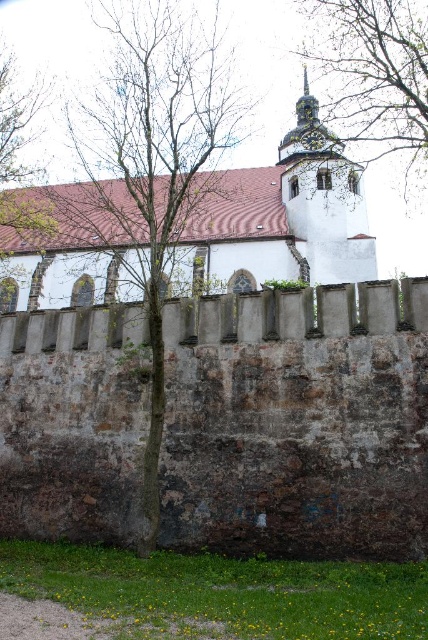
Between green leafy tree at upper right and green leafy tree at left, which one is positioned lower?

green leafy tree at left is below.

Is green leafy tree at upper right to the left of green leafy tree at left from the viewer's perspective?

In fact, green leafy tree at upper right is to the right of green leafy tree at left.

The width and height of the screenshot is (428, 640). Identify the location of green leafy tree at upper right. (374, 76).

Find the location of a particular element. The image size is (428, 640). green leafy tree at upper right is located at coordinates (374, 76).

Does brown bark tree at center appear on the right side of white stone church at upper center?

In fact, brown bark tree at center is to the left of white stone church at upper center.

Measure the distance between brown bark tree at center and white stone church at upper center.

brown bark tree at center is 40.66 feet away from white stone church at upper center.

Between point (139, 125) and point (226, 289), which one is positioned behind?

The point (139, 125) is behind.

The height and width of the screenshot is (640, 428). Find the location of `brown bark tree at center`. brown bark tree at center is located at coordinates (152, 163).

Who is positioned more to the left, brown bark tree at center or green leafy tree at left?

Positioned to the left is green leafy tree at left.

Can you confirm if brown bark tree at center is shorter than green leafy tree at left?

Incorrect, brown bark tree at center's height does not fall short of green leafy tree at left's.

Between point (207, 74) and point (11, 157), which one is positioned in front?

Point (207, 74) is more forward.

Locate an element on the screen. brown bark tree at center is located at coordinates (152, 163).